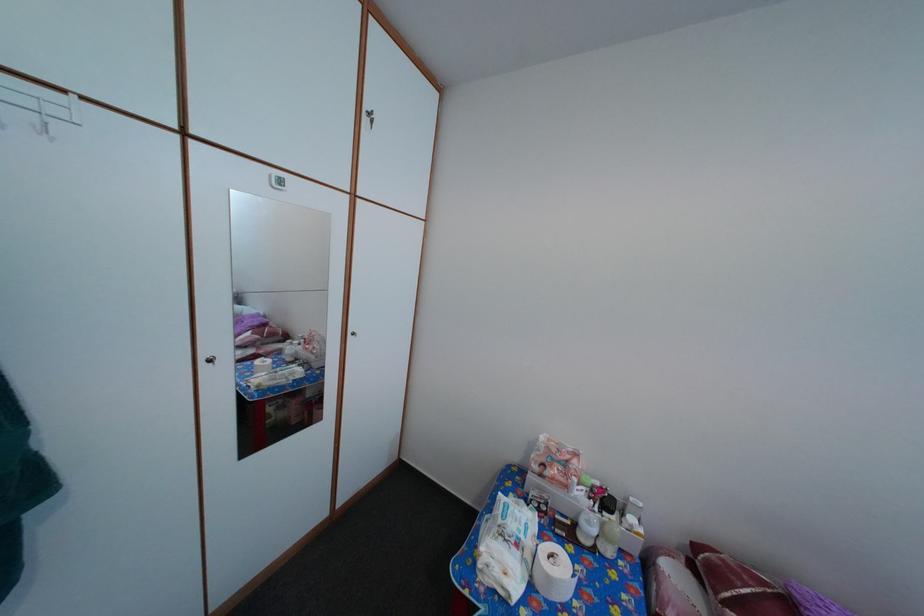
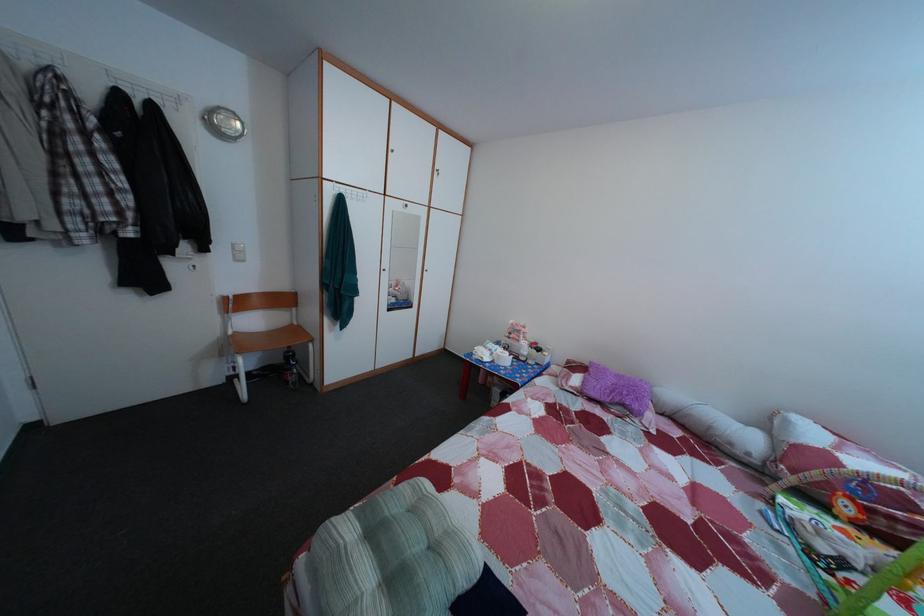
Find the pixel in the second image that matches (576,496) in the first image.

(528, 349)